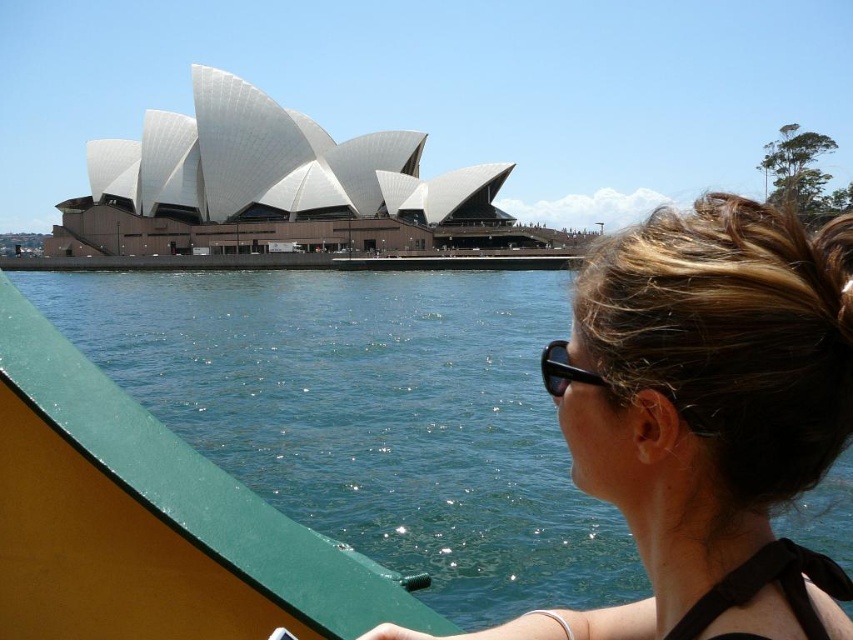
Measure the distance from black plastic goggles at upper right to black plastic sunglasses at upper right.

31.08 inches

Can you confirm if black plastic goggles at upper right is shorter than black plastic sunglasses at upper right?

Incorrect, black plastic goggles at upper right's height does not fall short of black plastic sunglasses at upper right's.

Who is more distant from viewer, (546, 344) or (543, 355)?

Positioned behind is point (546, 344).

You are a GUI agent. You are given a task and a screenshot of the screen. Output one action in this format:
    pyautogui.click(x=<x>, y=<y>)
    Task: Click on the black plastic goggles at upper right
    
    Given the screenshot: What is the action you would take?
    pyautogui.click(x=563, y=369)

Does blonde hair bun at center have a lesser height compared to black plastic goggles at upper right?

No, blonde hair bun at center is not shorter than black plastic goggles at upper right.

What do you see at coordinates (706, 420) in the screenshot? I see `blonde hair bun at center` at bounding box center [706, 420].

Find the location of a particular element. blonde hair bun at center is located at coordinates (706, 420).

Can you confirm if blonde hair bun at center is bigger than black plastic sunglasses at upper right?

Indeed, blonde hair bun at center has a larger size compared to black plastic sunglasses at upper right.

Consider the image. Is the position of blonde hair bun at center less distant than that of black plastic sunglasses at upper right?

Yes, blonde hair bun at center is in front of black plastic sunglasses at upper right.

Which is behind, point (815, 259) or point (540, 364)?

Point (540, 364)

You are a GUI agent. You are given a task and a screenshot of the screen. Output one action in this format:
    pyautogui.click(x=<x>, y=<y>)
    Task: Click on the blonde hair bun at center
    The width and height of the screenshot is (853, 640).
    Given the screenshot: What is the action you would take?
    pyautogui.click(x=706, y=420)